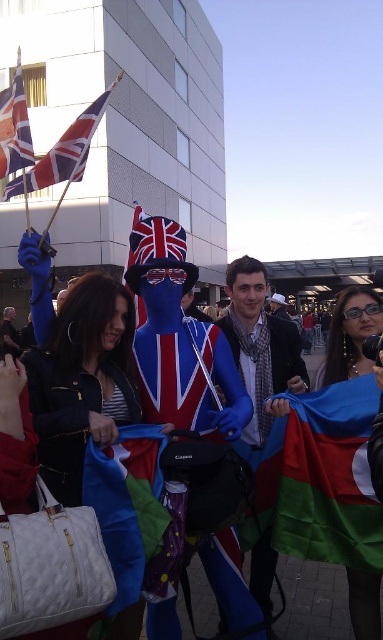
You are attending a patriotic event and see two flags, the polyester flag at center and the union jack fabric flag at upper left. Which flag is located to the right of the other?

The polyester flag at center is positioned on the right side of union jack fabric flag at upper left.

You are organizing a photo shoot and need to ensure that the blue fabric jacket at center is visible in the frame. Given that the union jack flag at upper left is larger, how might you adjust the camera angle to prioritize the jacket?

Since the blue fabric jacket at center is smaller than the union jack flag at upper left, you could zoom in slightly on the blue fabric jacket at center to make it appear larger relative to the flag, or position the camera closer to the jacket to emphasize its size while still including the flag in the background.